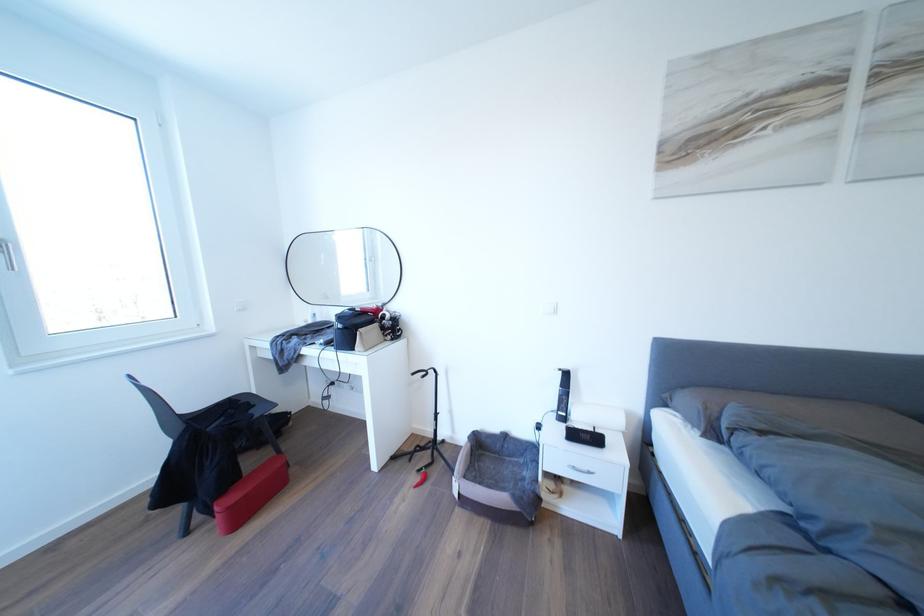
What do you see at coordinates (344, 267) in the screenshot?
I see `the oval desk mirror` at bounding box center [344, 267].